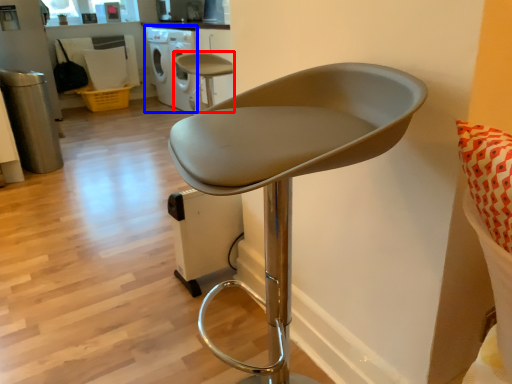
Question: Which point is closer to the camera, chair (highlighted by a red box) or dish washer (highlighted by a blue box)?

Choices:
 (A) chair
 (B) dish washer

Answer: (A)